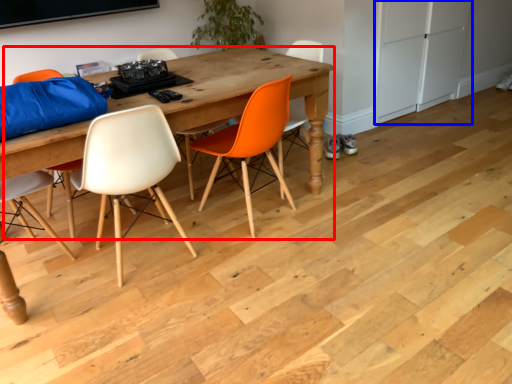
Question: Which point is closer to the camera, table (highlighted by a red box) or cabinetry (highlighted by a blue box)?

Choices:
 (A) table
 (B) cabinetry

Answer: (A)